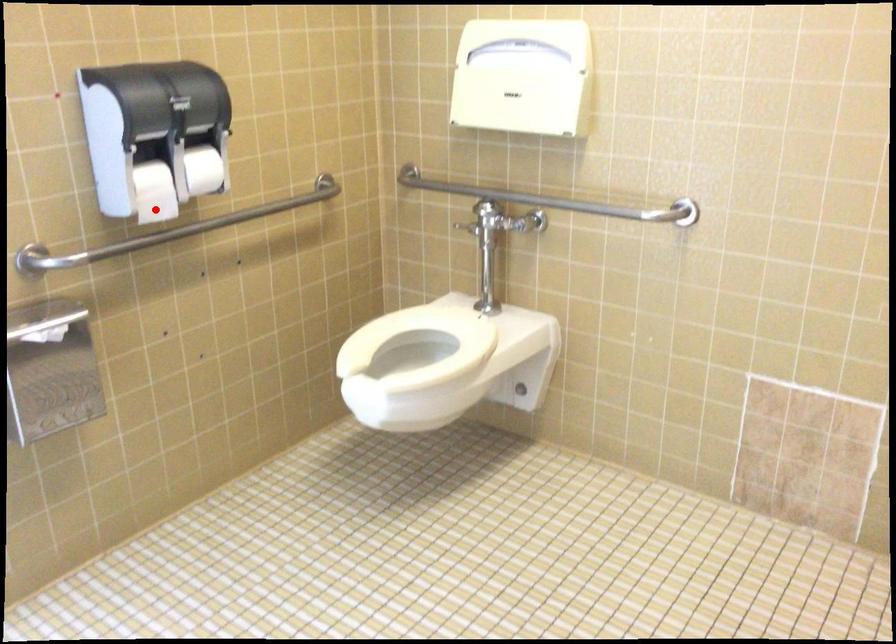
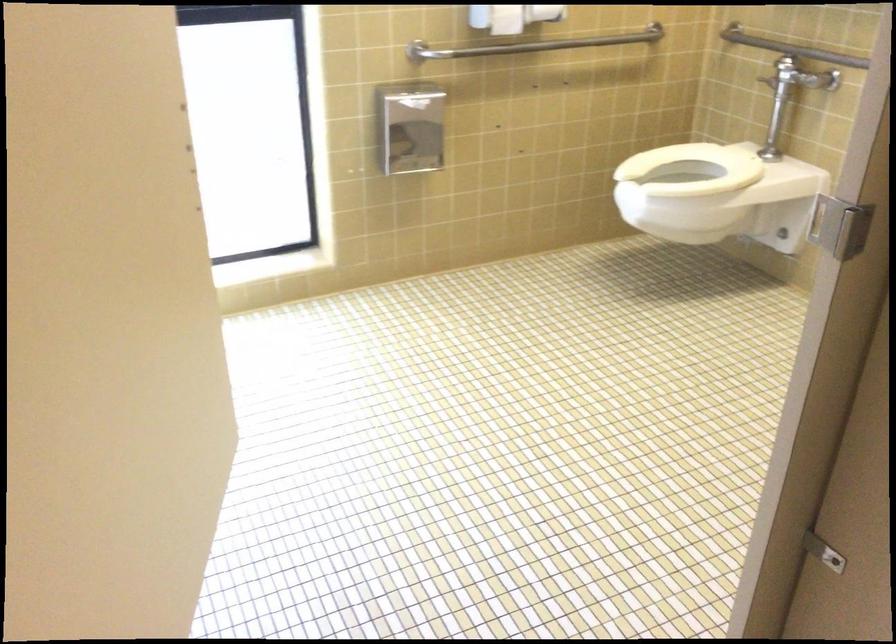
Question: I am providing you with two images of the same scene from different viewpoints. A red point is marked on the first image. At the location where the point appears in image 1, is it still visible in image 2?

Choices:
 (A) Yes
 (B) No

Answer: (A)